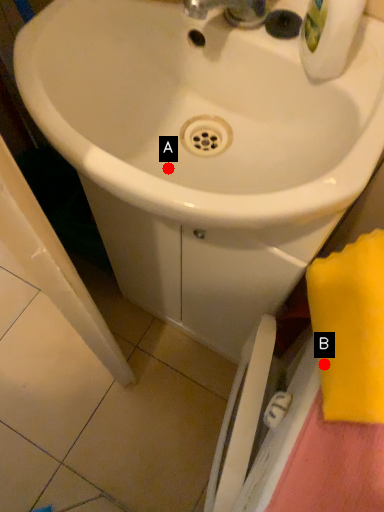
Question: Two points are circled on the image, labeled by A and B beside each circle. Which point is farther from the camera taking this photo?

Choices:
 (A) A is further
 (B) B is further

Answer: (A)